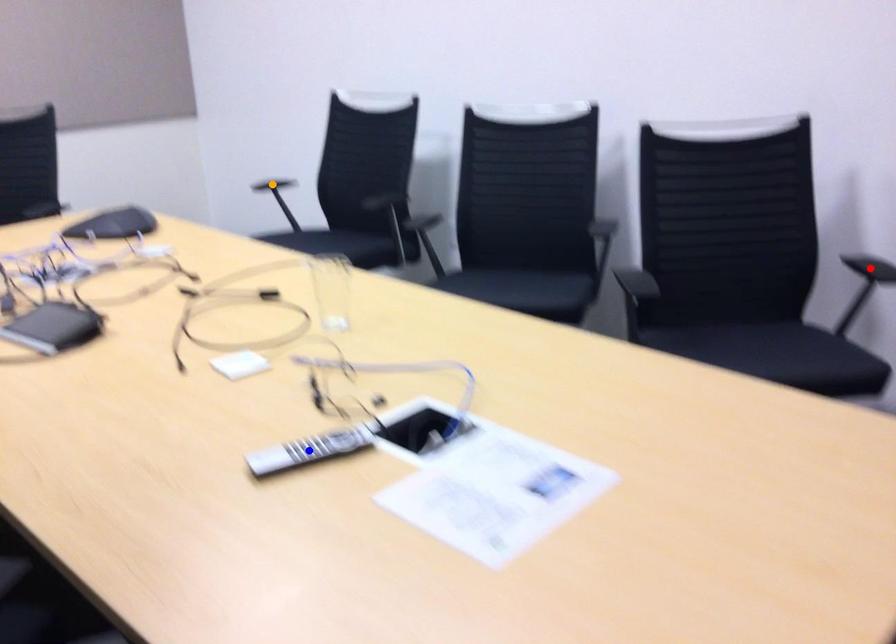
Order these from nearest to farthest:
1. red point
2. blue point
3. orange point

1. blue point
2. red point
3. orange point